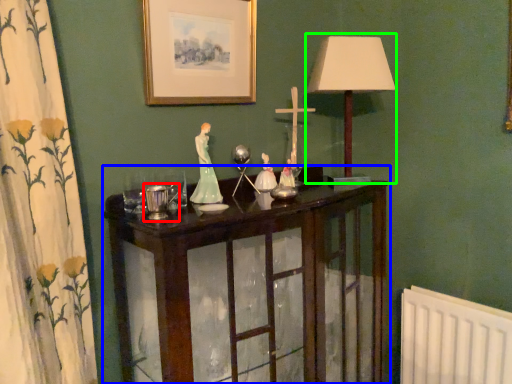
Question: Which object is the farthest from candle holder (highlighted by a red box)? Choose among these: furniture (highlighted by a blue box) or table lamp (highlighted by a green box).

Choices:
 (A) furniture
 (B) table lamp

Answer: (B)